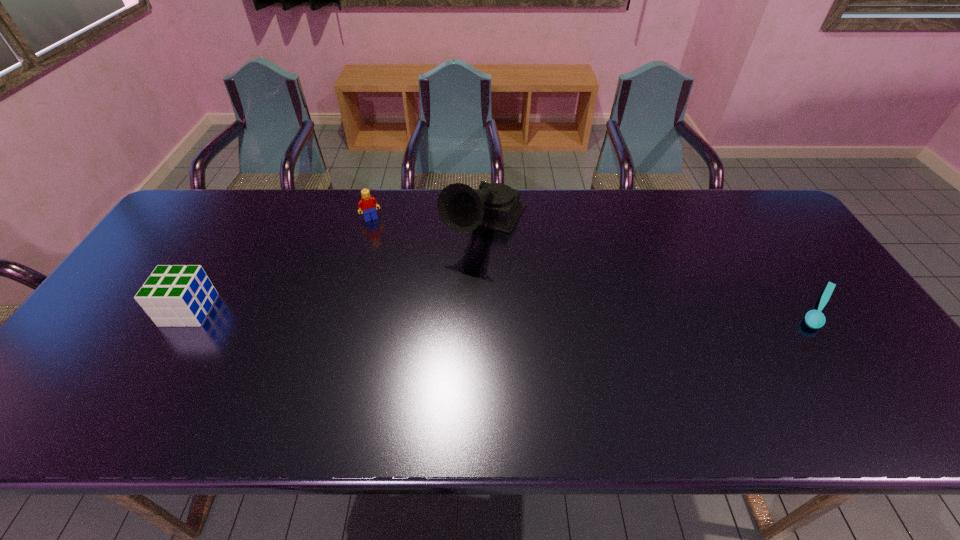
Locate an element on the screen. The height and width of the screenshot is (540, 960). vacant space located 0.160m from the horn of the phonograph_record is located at coordinates (444, 301).

Image resolution: width=960 pixels, height=540 pixels. What are the coordinates of `vacant space located 0.250m on the face of the third object from right to left` in the screenshot? It's located at (399, 272).

Where is `vacant space located on the face of the third object from right to left`? This screenshot has width=960, height=540. vacant space located on the face of the third object from right to left is located at coordinates (384, 241).

Where is `vacant area situated on the face of the third object from right to left`? Image resolution: width=960 pixels, height=540 pixels. vacant area situated on the face of the third object from right to left is located at coordinates (404, 281).

Locate an element on the screen. Image resolution: width=960 pixels, height=540 pixels. phonograph_record that is at the far edge is located at coordinates (461, 208).

The height and width of the screenshot is (540, 960). I want to click on Lego at the far edge, so click(368, 204).

I want to click on object that is at the left edge, so click(178, 295).

The width and height of the screenshot is (960, 540). In order to click on object at the right edge in this screenshot , I will do `click(815, 319)`.

This screenshot has width=960, height=540. In the image, there is a desktop. Find the location of `vacant space at the far edge`. vacant space at the far edge is located at coordinates (274, 212).

This screenshot has width=960, height=540. What are the coordinates of `vacant area at the near edge of the desktop` in the screenshot? It's located at (619, 393).